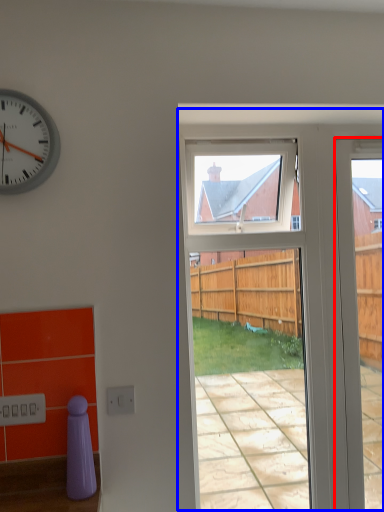
Question: Which of the following is the farthest to the observer, door (highlighted by a red box) or screen door (highlighted by a blue box)?

Choices:
 (A) door
 (B) screen door

Answer: (A)